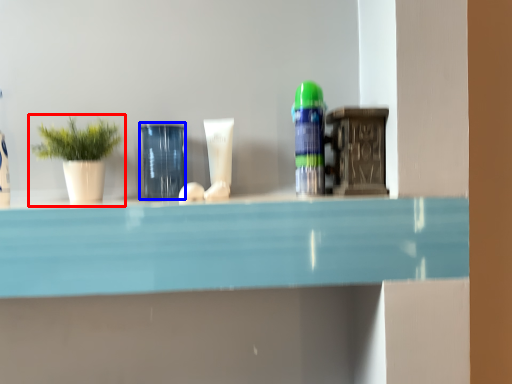
Question: Which point is further to the camera, houseplant (highlighted by a red box) or glass vase (highlighted by a blue box)?

Choices:
 (A) houseplant
 (B) glass vase

Answer: (B)